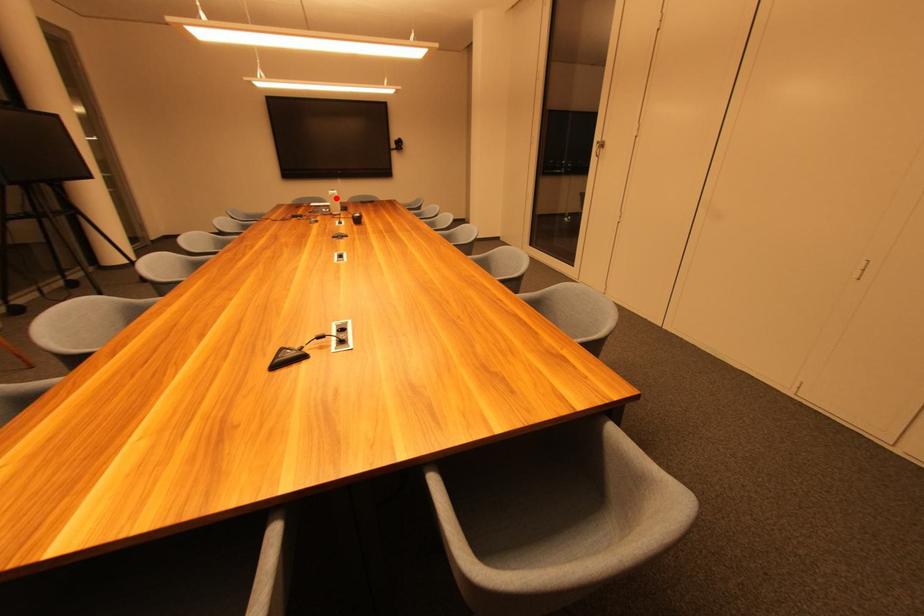
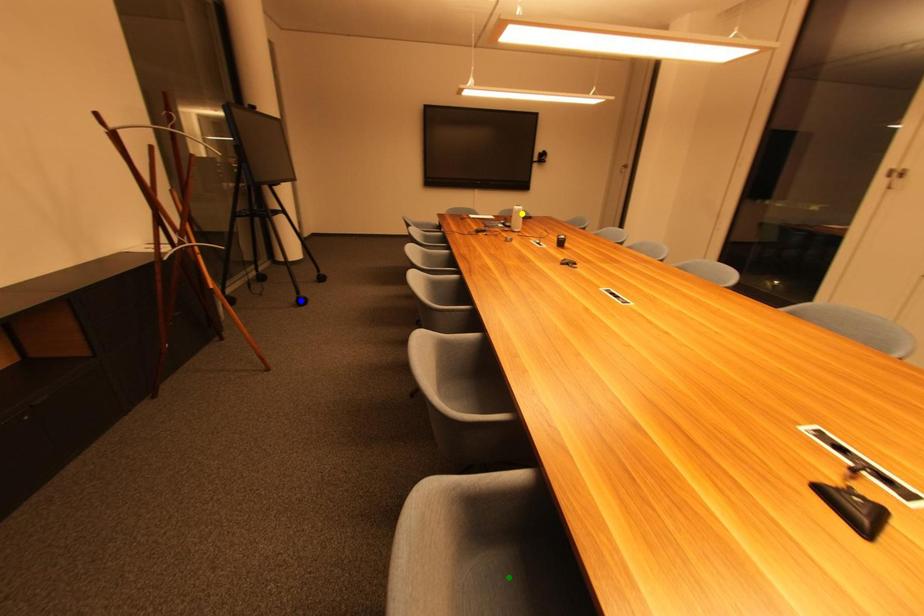
Question: I am providing you with two images of the same scene from different viewpoints. A red point is marked on the first image. You are given multiple points on the second image. Can you choose the point in image 2 that corresponds to the point in image 1?

Choices:
 (A) blue point
 (B) green point
 (C) yellow point

Answer: (C)